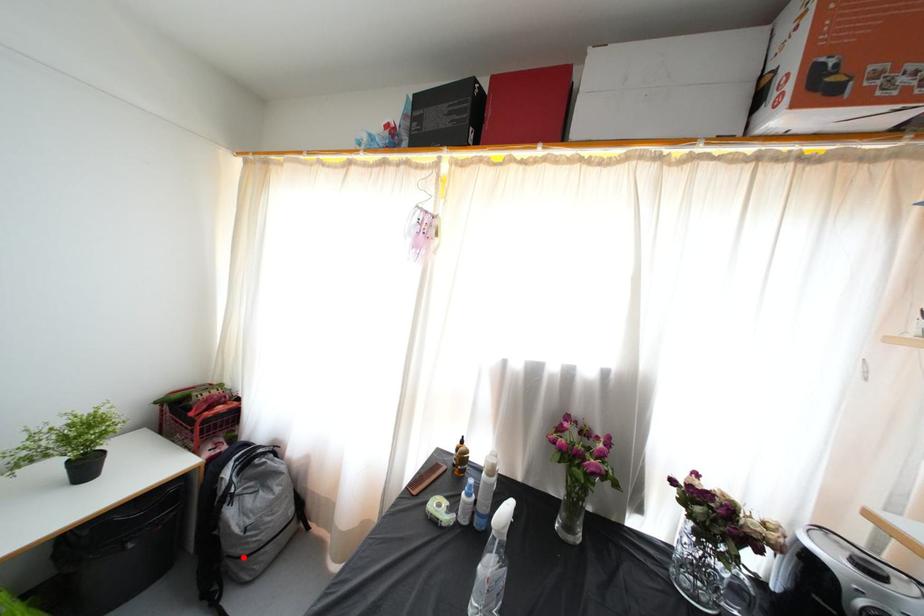
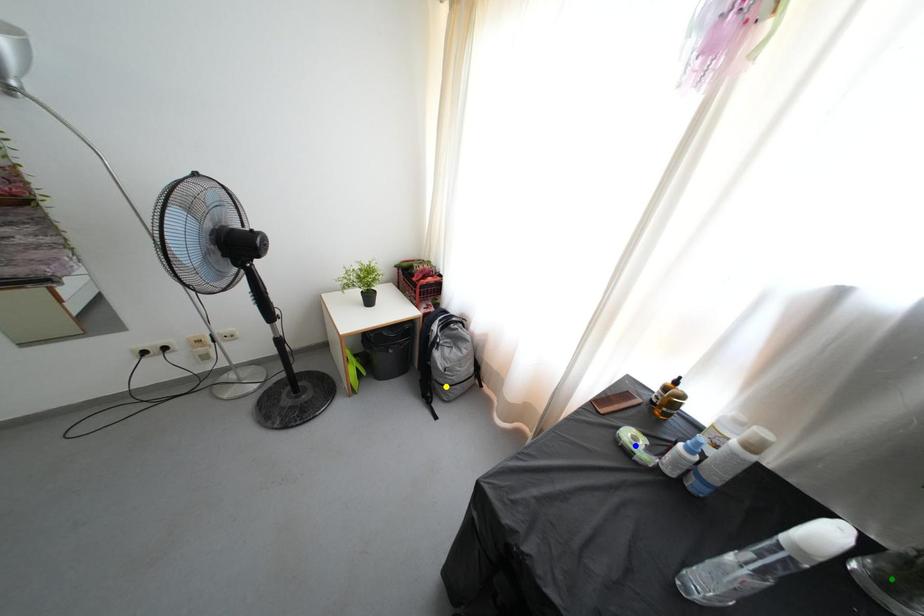
Question: I am providing you with two images of the same scene from different viewpoints. A red point is marked on the first image. You are given multiple points on the second image. Can you choose the point in image 2 that corresponds to the point in image 1?

Choices:
 (A) yellow point
 (B) green point
 (C) blue point

Answer: (A)